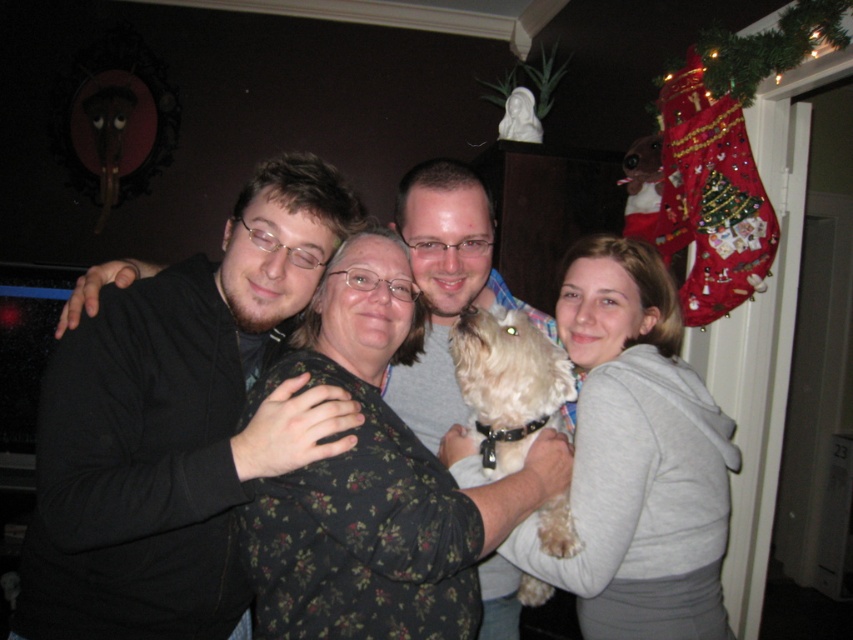
Please look at the coordinates point (178, 424) in the image. What object is located there?

The point (178, 424) indicates the black matte jacket at left.